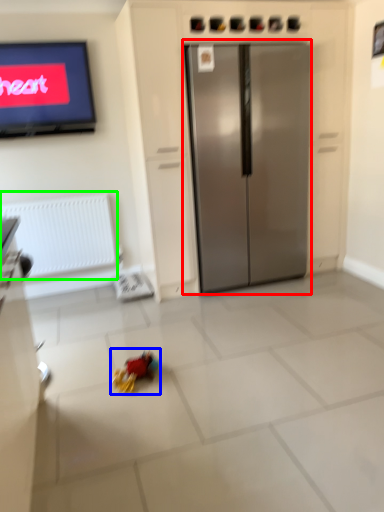
Question: Which object is positioned closest to refrigerator (highlighted by a red box)? Select from miniature (highlighted by a blue box) and radiator (highlighted by a green box).

Choices:
 (A) miniature
 (B) radiator

Answer: (B)